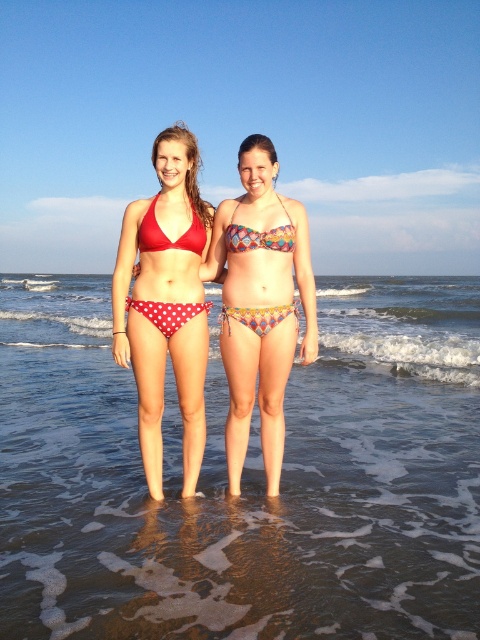
Question: Among these points, which one is farthest from the camera?

Choices:
 (A) 454,621
 (B) 168,168

Answer: (B)

Question: In this image, where is polka dot matte bikini at center located relative to multicolored printed bikini bottom at center?

Choices:
 (A) right
 (B) left

Answer: (B)

Question: Which is farther from the printed bikini top at center?

Choices:
 (A) multicolored printed bikini bottom at center
 (B) polka dot matte bikini at center
 (C) clear water at lower center
 (D) polka dot bikini at center

Answer: (C)

Question: Can you confirm if clear water at lower center is thinner than multicolored printed bikini bottom at center?

Choices:
 (A) no
 (B) yes

Answer: (A)

Question: Which object appears closest to the camera in this image?

Choices:
 (A) printed bikini top at center
 (B) clear water at lower center
 (C) multicolored printed bikini bottom at center
 (D) polka dot matte bikini at center

Answer: (B)

Question: Can you confirm if clear water at lower center is bigger than polka dot matte bikini at center?

Choices:
 (A) no
 (B) yes

Answer: (B)